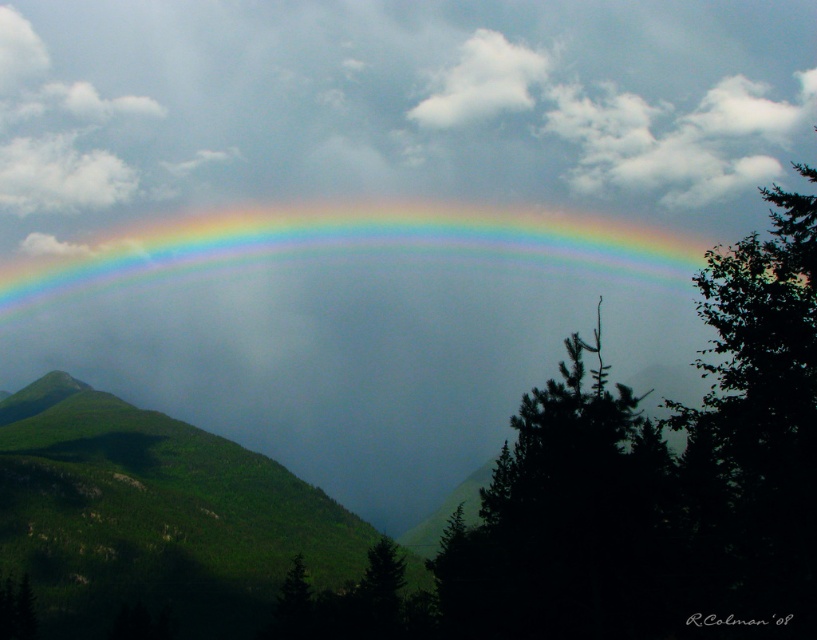
Question: Does green grassy hillside at lower left have a smaller size compared to rainbow at center?

Choices:
 (A) no
 (B) yes

Answer: (B)

Question: Estimate the real-world distances between objects in this image. Which object is closer to the green matte tree at center?

Choices:
 (A) green grassy hillside at lower left
 (B) rainbow at center
 (C) white fluffy cloud at upper center

Answer: (A)

Question: Considering the real-world distances, which object is farthest from the green grassy hillside at lower left?

Choices:
 (A) white fluffy cloud at upper center
 (B) rainbow at center

Answer: (A)

Question: Can you confirm if green grassy hillside at lower left is smaller than green matte tree at center?

Choices:
 (A) no
 (B) yes

Answer: (A)

Question: Which of the following is the farthest from the observer?

Choices:
 (A) (523, 84)
 (B) (132, 182)
 (C) (141, 470)
 (D) (645, 272)

Answer: (B)

Question: Does green grassy hillside at lower left lie behind white fluffy cloud at upper center?

Choices:
 (A) yes
 (B) no

Answer: (B)